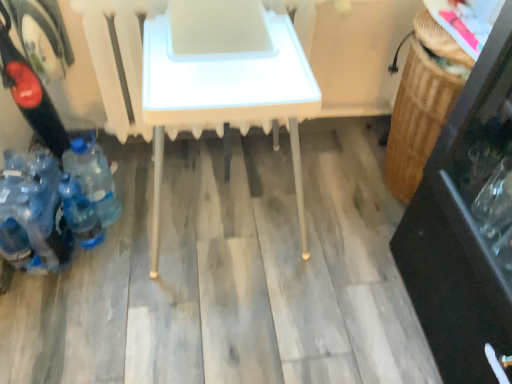
Find the location of a particular element. The image size is (512, 384). free space between white plastic table at center and blue plastic bottle at lower left, arranged as the first bottle when viewed from the right is located at coordinates (132, 230).